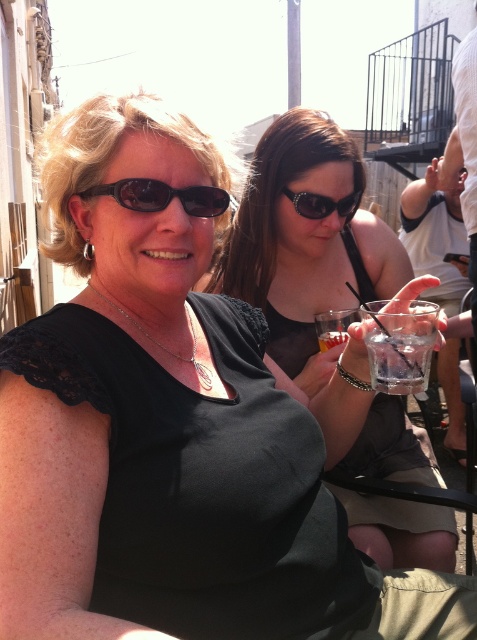
You are a bartender at this event and need to place a new drink between the black matte shirt at center and the clear glass at center. The drink requires 10 inches of space. Is there enough space?

The distance between the black matte shirt at center and the clear glass at center is 12.64 inches, which is more than the required 10 inches. Therefore, there is enough space to place the new drink between them.

You are at a social event and want to know which object is bigger between the black matte shirt at center and the clear glass at lower right. Can you tell me?

The black matte shirt at center is larger in size than the clear glass at lower right.

You are standing at the point marked as point (x=307, y=275) in the image. The distance from you to the viewer is 5.41 feet. If you want to move closer to the viewer, which direction should you go?

Since the point (x=307, y=275) is 5.41 feet away from the viewer, moving towards the viewer would require moving forward in the direction facing away from the background of the image.